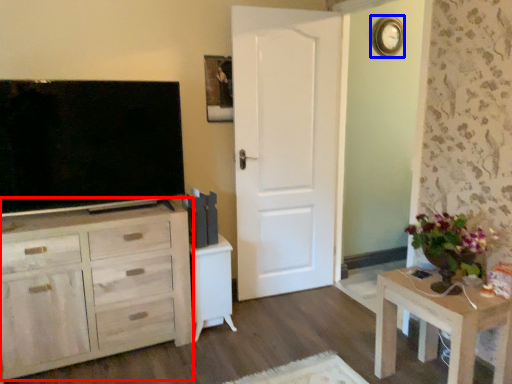
Question: Which of the following is the farthest to the observer, cabinetry (highlighted by a red box) or clock (highlighted by a blue box)?

Choices:
 (A) cabinetry
 (B) clock

Answer: (B)